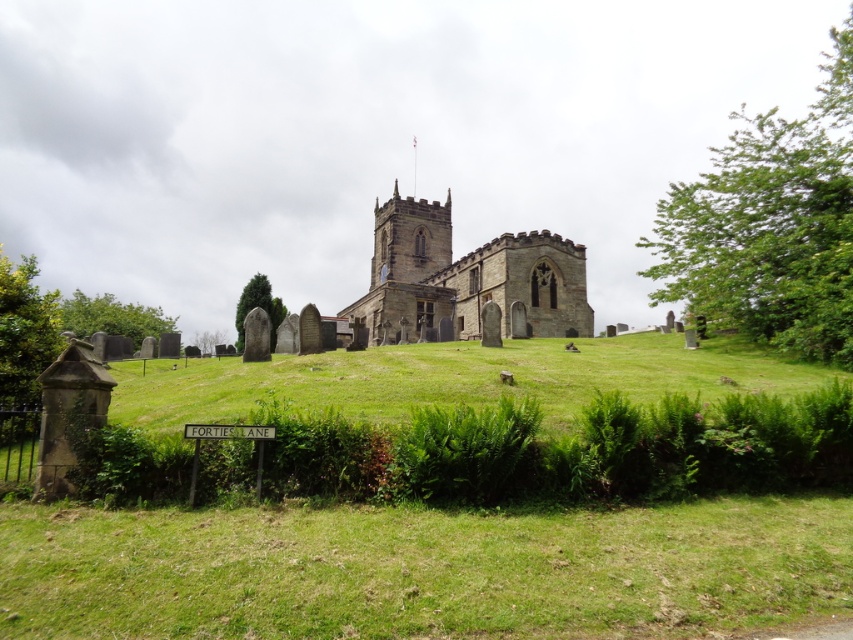
Is green leafy tree at left smaller than green textured stone at center?

Actually, green leafy tree at left might be larger than green textured stone at center.

Can you confirm if green leafy tree at left is positioned above green textured stone at center?

Yes, green leafy tree at left is above green textured stone at center.

Locate an element on the screen. Image resolution: width=853 pixels, height=640 pixels. green leafy tree at left is located at coordinates (22, 344).

Who is taller, green leafy tree at left or green leafy tree at lower left?

With more height is green leafy tree at left.

Does point (22, 260) come farther from viewer compared to point (148, 323)?

That is True.

Does point (24, 412) come farther from viewer compared to point (138, 321)?

That is False.

This screenshot has width=853, height=640. Find the location of `green leafy tree at left`. green leafy tree at left is located at coordinates (22, 344).

Does green leafy tree at upper right have a lesser height compared to green leafy tree at center?

In fact, green leafy tree at upper right may be taller than green leafy tree at center.

Can you confirm if green leafy tree at upper right is positioned to the right of green leafy tree at center?

Correct, you'll find green leafy tree at upper right to the right of green leafy tree at center.

Is point (846, 324) closer to viewer compared to point (201, 346)?

Yes, point (846, 324) is closer to viewer.

I want to click on green leafy tree at upper right, so click(x=770, y=225).